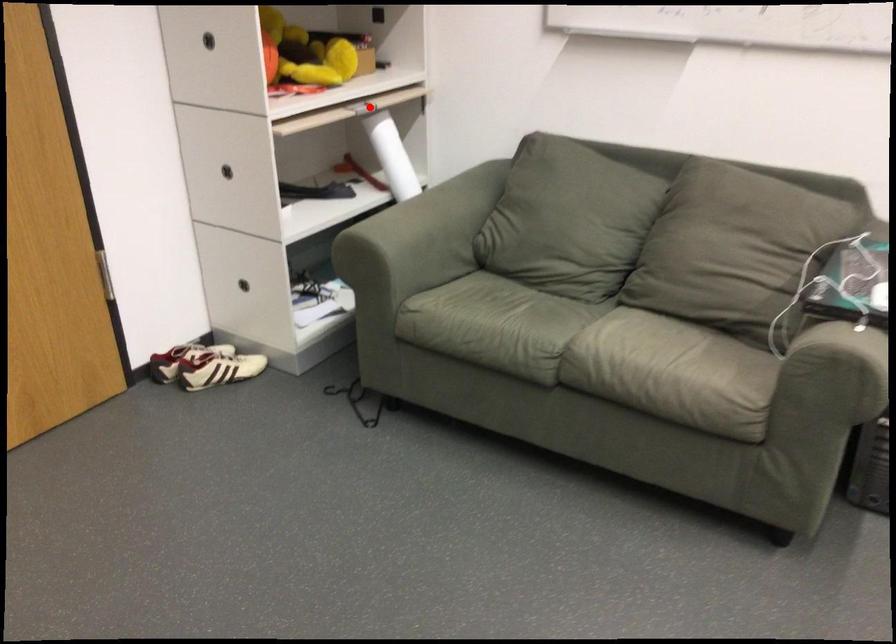
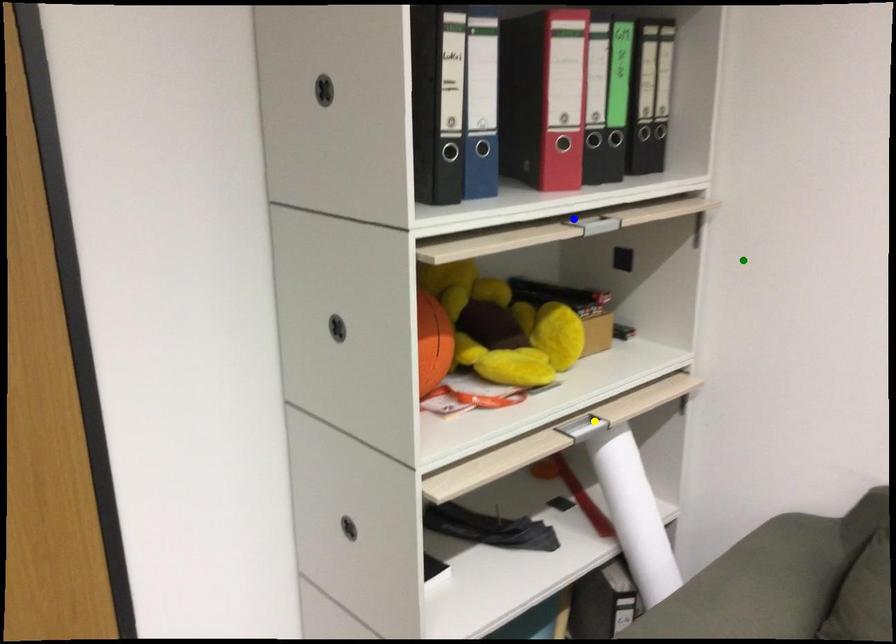
Question: I am providing you with two images of the same scene from different viewpoints. A red point is marked on the first image. You are given multiple points on the second image. In image 2, which mark is for the same physical point as the one in image 1?

Choices:
 (A) green point
 (B) blue point
 (C) yellow point

Answer: (C)